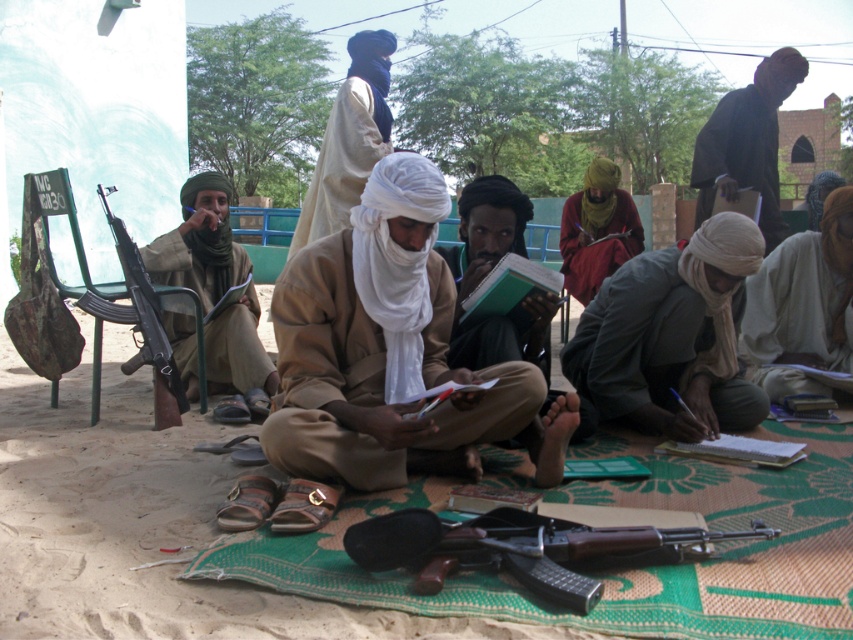
Consider the image. Is white cotton robe at lower right above red matte robe at center?

No, white cotton robe at lower right is not above red matte robe at center.

Describe the element at coordinates (796, 320) in the screenshot. I see `white cotton robe at lower right` at that location.

Find the location of a particular element. The width and height of the screenshot is (853, 640). white cotton robe at lower right is located at coordinates (796, 320).

Image resolution: width=853 pixels, height=640 pixels. In order to click on white cotton robe at lower right in this screenshot , I will do click(x=796, y=320).

Consider the image. Between matte black rifle at lower center and white cloth headscarf at center, which one appears on the right side from the viewer's perspective?

From the viewer's perspective, matte black rifle at lower center appears more on the right side.

Is point (473, 518) in front of point (532, 337)?

Yes, it is in front of point (532, 337).

Does point (585, 593) lie in front of point (505, 340)?

Yes, point (585, 593) is in front of point (505, 340).

You are a GUI agent. You are given a task and a screenshot of the screen. Output one action in this format:
    pyautogui.click(x=<x>, y=<y>)
    Task: Click on the matte black rifle at lower center
    The width and height of the screenshot is (853, 640).
    Given the screenshot: What is the action you would take?
    (x=519, y=548)

Which is more to the left, white cloth headscarf at center or red matte robe at center?

Positioned to the left is white cloth headscarf at center.

Does white cloth headscarf at center appear under red matte robe at center?

Yes.

Does point (514, 200) come in front of point (592, 282)?

Yes, it is.

In order to click on white cloth headscarf at center in this screenshot , I will do `click(486, 272)`.